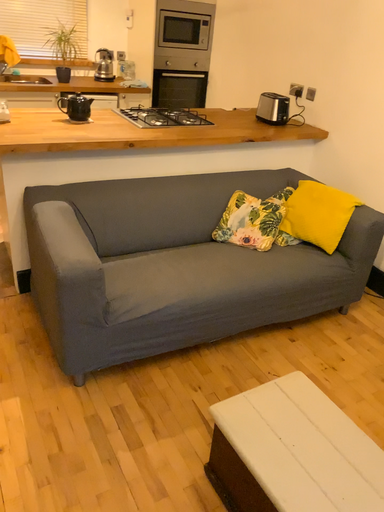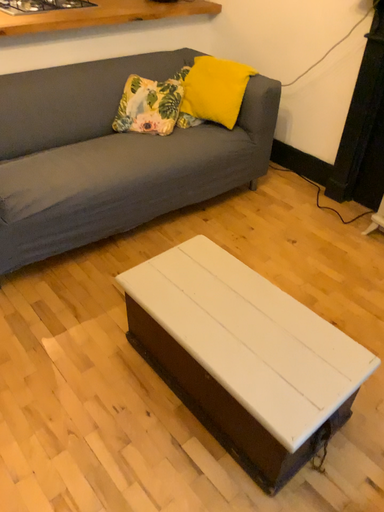
Question: Which way did the camera rotate in the video?

Choices:
 (A) rotated left
 (B) rotated right

Answer: (B)